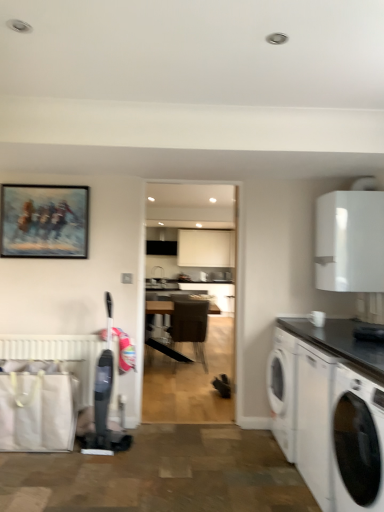
Question: Is black granite countertop at right completely or partially inside oil painting at upper left?

Choices:
 (A) yes
 (B) no

Answer: (B)

Question: Is black granite countertop at right at the back of oil painting at upper left?

Choices:
 (A) no
 (B) yes

Answer: (A)

Question: Considering the relative sizes of oil painting at upper left and black granite countertop at right in the image provided, is oil painting at upper left shorter than black granite countertop at right?

Choices:
 (A) yes
 (B) no

Answer: (B)

Question: From a real-world perspective, is oil painting at upper left beneath black granite countertop at right?

Choices:
 (A) no
 (B) yes

Answer: (A)

Question: Would you consider oil painting at upper left to be distant from black granite countertop at right?

Choices:
 (A) yes
 (B) no

Answer: (A)

Question: Is oil painting at upper left positioned in front of black granite countertop at right?

Choices:
 (A) yes
 (B) no

Answer: (B)

Question: Is there a large distance between oil painting at upper left and white glossy washing machine at lower right?

Choices:
 (A) yes
 (B) no

Answer: (A)

Question: Is the position of oil painting at upper left more distant than that of white glossy washing machine at lower right?

Choices:
 (A) yes
 (B) no

Answer: (A)

Question: From a real-world perspective, does oil painting at upper left stand above white glossy washing machine at lower right?

Choices:
 (A) no
 (B) yes

Answer: (B)

Question: Considering the relative sizes of oil painting at upper left and white glossy washing machine at lower right in the image provided, is oil painting at upper left bigger than white glossy washing machine at lower right?

Choices:
 (A) no
 (B) yes

Answer: (A)

Question: Is the surface of oil painting at upper left in direct contact with white glossy washing machine at lower right?

Choices:
 (A) yes
 (B) no

Answer: (B)

Question: Is oil painting at upper left turned away from white glossy washing machine at lower right?

Choices:
 (A) yes
 (B) no

Answer: (B)

Question: Can you confirm if white matte radiator at lower left is thinner than black glossy countertop at lower right?

Choices:
 (A) yes
 (B) no

Answer: (A)